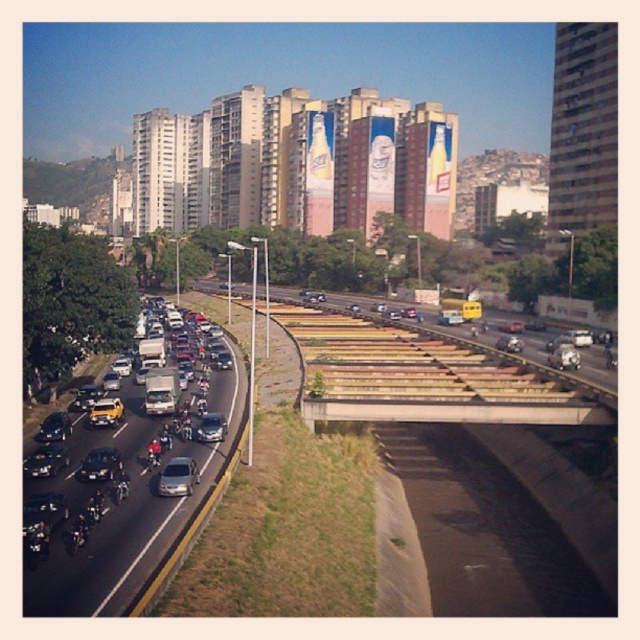
Does concrete at center have a larger size compared to shiny silver sedan at center?

Yes.

From the picture: Who is positioned more to the right, concrete at center or shiny silver sedan at center?

From the viewer's perspective, concrete at center appears more on the right side.

Describe the element at coordinates (452, 412) in the screenshot. I see `concrete at center` at that location.

Where is `concrete at center`? concrete at center is located at coordinates (452, 412).

Image resolution: width=640 pixels, height=640 pixels. I want to click on concrete at center, so click(452, 412).

What do you see at coordinates (452, 412) in the screenshot? I see `concrete at center` at bounding box center [452, 412].

The height and width of the screenshot is (640, 640). I want to click on concrete at center, so click(x=452, y=412).

You are a GUI agent. You are given a task and a screenshot of the screen. Output one action in this format:
    pyautogui.click(x=<x>, y=<y>)
    Task: Click on the silver metallic van at center-left
    The image size is (640, 640).
    Given the screenshot: What is the action you would take?
    pyautogui.click(x=161, y=392)

Describe the element at coordinates (161, 392) in the screenshot. I see `silver metallic van at center-left` at that location.

This screenshot has height=640, width=640. What are the coordinates of `silver metallic van at center-left` in the screenshot? It's located at (161, 392).